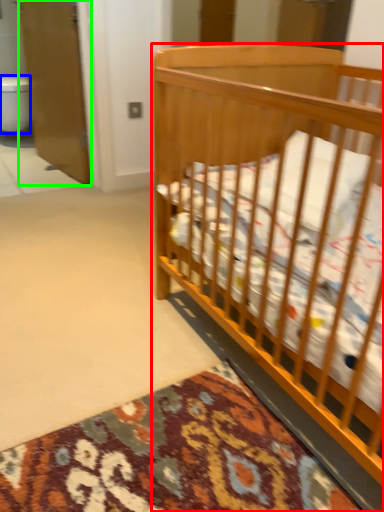
Question: Which is farther away from infant bed (highlighted by a red box)? toilet bowl (highlighted by a blue box) or screen door (highlighted by a green box)?

Choices:
 (A) toilet bowl
 (B) screen door

Answer: (A)